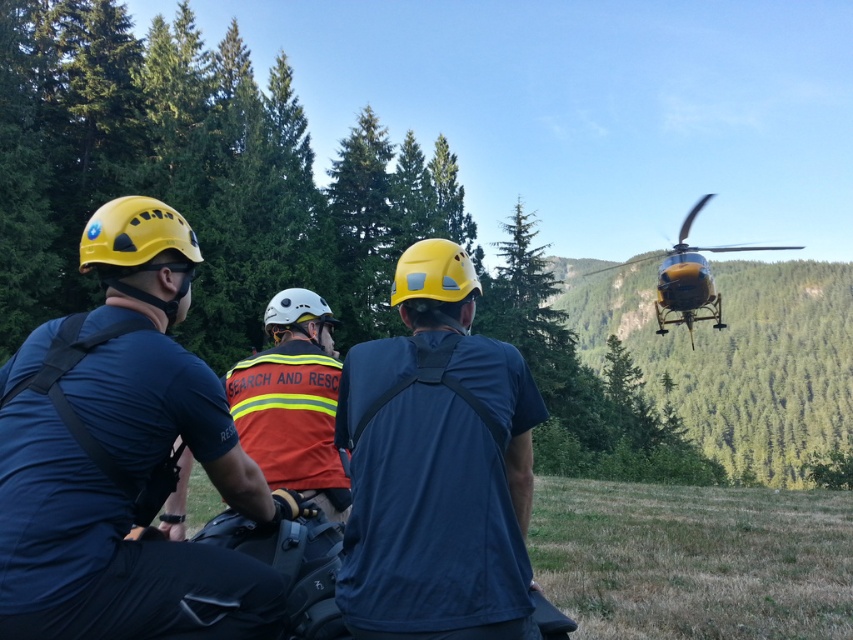
You are a drone operator trying to capture a clear image of the two points in the scene. The first point is at coordinates point (154, 218) and the second point is at point (433, 435). Which point is closer to the drone camera if it is positioned at the same height as the helicopter?

Point (154, 218) is closer to the viewer than point (433, 435), so the drone camera would capture it more clearly.

You are a member of the search and rescue team. You need to identify which piece of equipment is taller between the matte yellow helmet at center and the orange reflective safety vest at center. Which one is taller?

The matte yellow helmet at center is taller than the orange reflective safety vest at center.